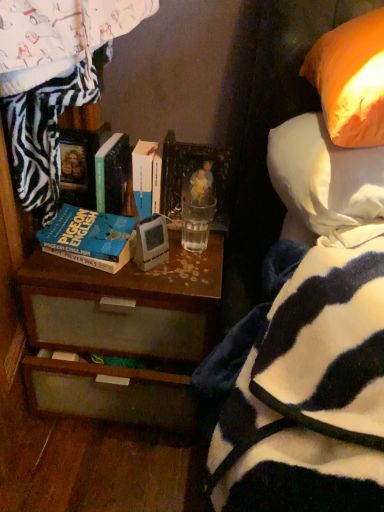
Locate an element on the screen. The image size is (384, 512). vacant area that lies to the right of blue matte book at center left, the 3th book viewed from the right is located at coordinates (178, 268).